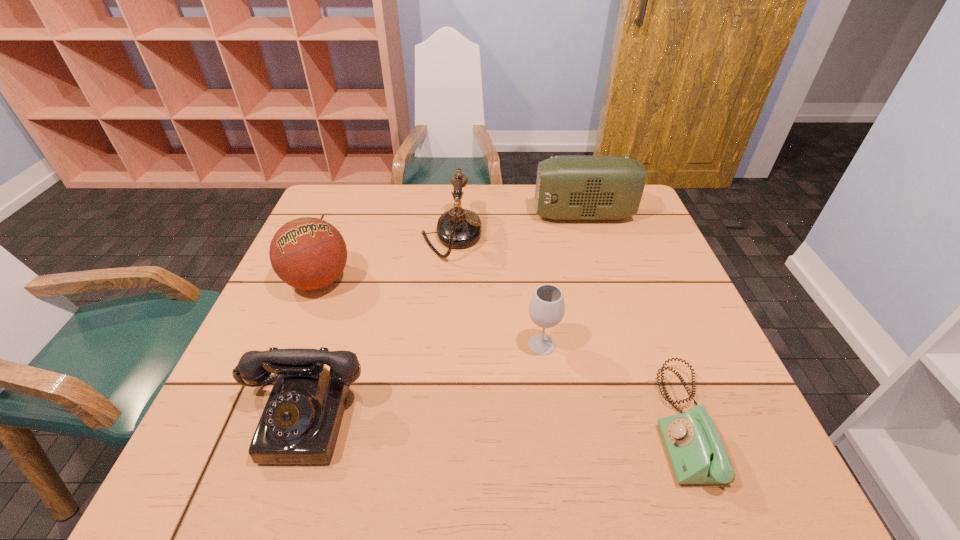
At what (x,y) coordinates should I click in order to perform the action: click on vacant space located on the front-facing side of the radio_receiver. Please return your answer as a coordinate pair (x, y). Looking at the image, I should click on (512, 215).

You are a GUI agent. You are given a task and a screenshot of the screen. Output one action in this format:
    pyautogui.click(x=<x>, y=<y>)
    Task: Click on the free space located on the front of the basketball
    This screenshot has width=960, height=540.
    Given the screenshot: What is the action you would take?
    pyautogui.click(x=285, y=362)

Where is `vacant area situated on the dial of the second telephone from left to right`? The width and height of the screenshot is (960, 540). vacant area situated on the dial of the second telephone from left to right is located at coordinates (571, 235).

Where is `vacant space situated 0.180m on the front of the third nearest object`? This screenshot has height=540, width=960. vacant space situated 0.180m on the front of the third nearest object is located at coordinates coord(554,436).

This screenshot has height=540, width=960. Identify the location of vacant space situated on the dial of the rightmost telephone. click(518, 423).

Where is `vacant space located on the dial of the rightmost telephone`? vacant space located on the dial of the rightmost telephone is located at coordinates (481, 423).

Locate an element on the screen. The height and width of the screenshot is (540, 960). vacant space located on the dial of the rightmost telephone is located at coordinates (555, 423).

You are a GUI agent. You are given a task and a screenshot of the screen. Output one action in this format:
    pyautogui.click(x=<x>, y=<y>)
    Task: Click on the radio_receiver at the far edge
    The height and width of the screenshot is (540, 960).
    Given the screenshot: What is the action you would take?
    pyautogui.click(x=567, y=187)

Identify the location of telephone that is at the far edge. (457, 228).

The width and height of the screenshot is (960, 540). I want to click on basketball that is at the left edge, so click(307, 253).